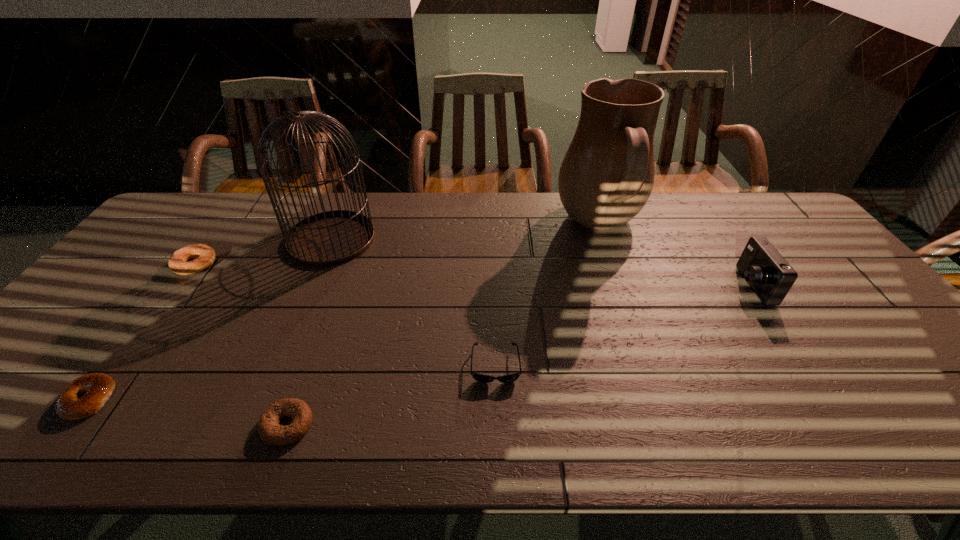
Identify the location of vacant space located 0.140m on the front of the birdcage. (306, 300).

The width and height of the screenshot is (960, 540). Find the location of `free region located on the front-facing side of the rightmost object`. free region located on the front-facing side of the rightmost object is located at coordinates (649, 286).

This screenshot has width=960, height=540. Identify the location of vacant space positioned 0.200m on the front-facing side of the rightmost object. (667, 286).

This screenshot has width=960, height=540. I want to click on vacant space located on the front-facing side of the rightmost object, so click(x=678, y=286).

Find the location of `vacant space situated 0.240m on the right of the tallest bagel`. vacant space situated 0.240m on the right of the tallest bagel is located at coordinates (297, 265).

Locate an element on the screen. Image resolution: width=960 pixels, height=540 pixels. vacant position located on the front-facing side of the third object from right to left is located at coordinates (497, 422).

I want to click on vacant position located on the right of the rightmost bagel, so click(x=342, y=424).

This screenshot has height=540, width=960. In order to click on cream pitcher that is at the far edge in this screenshot , I will do `click(607, 175)`.

The width and height of the screenshot is (960, 540). Identify the location of birdcage situated at the far edge. (329, 238).

Locate an element on the screen. The image size is (960, 540). object positioned at the near left corner is located at coordinates (98, 386).